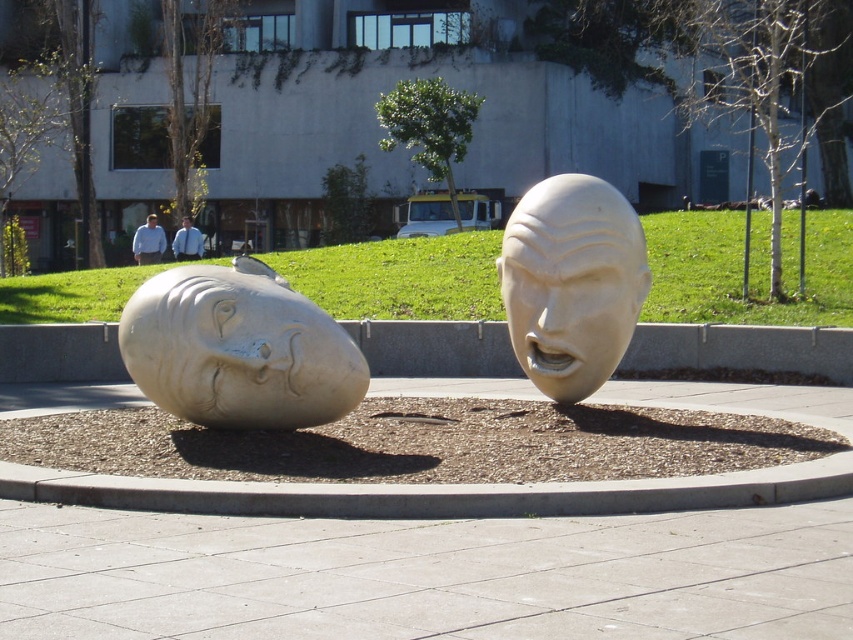
Who is higher up, white stone head at left or white marble head at center?

white marble head at center is above.

Locate an element on the screen. This screenshot has width=853, height=640. white stone head at left is located at coordinates (238, 349).

At what (x,y) coordinates should I click in order to perform the action: click on white stone head at left. Please return your answer as a coordinate pair (x, y). Image resolution: width=853 pixels, height=640 pixels. Looking at the image, I should click on (238, 349).